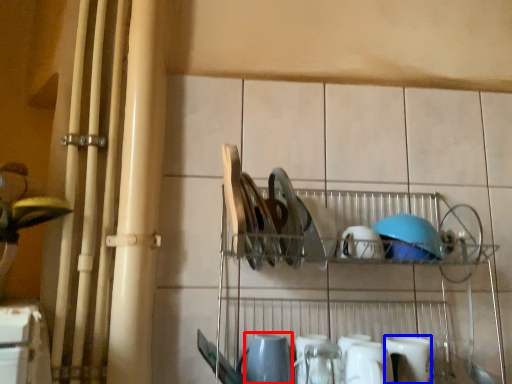
Question: Which of the following is the farthest to the observer, tableware (highlighted by a red box) or tableware (highlighted by a blue box)?

Choices:
 (A) tableware
 (B) tableware

Answer: (B)